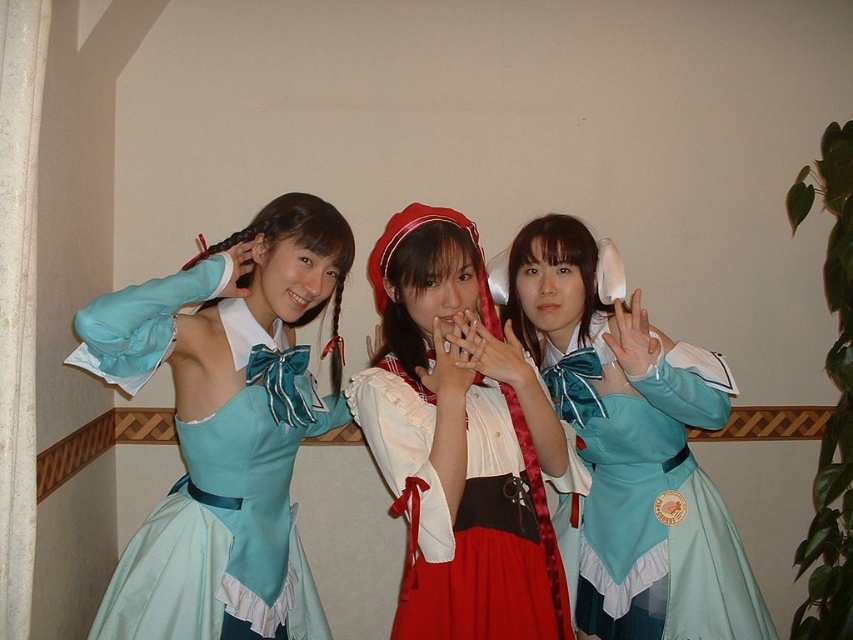
Between matte blue dress at left and matte blue dress at center, which one appears on the left side from the viewer's perspective?

matte blue dress at left is more to the left.

Who is shorter, matte blue dress at left or matte blue dress at center?

matte blue dress at left

At what (x,y) coordinates should I click in order to perform the action: click on matte blue dress at left. Please return your answer as a coordinate pair (x, y). Looking at the image, I should click on (225, 426).

Between point (181, 566) and point (421, 310), which one is positioned in front?

Point (421, 310) is more forward.

Measure the distance between matte blue dress at left and matte white blouse at center.

matte blue dress at left is 15.43 inches away from matte white blouse at center.

Between point (229, 308) and point (473, 449), which one is positioned behind?

The point (229, 308) is behind.

I want to click on matte blue dress at left, so click(225, 426).

Does matte white blouse at center appear on the right side of matte blue dress at center?

Incorrect, matte white blouse at center is not on the right side of matte blue dress at center.

Does matte white blouse at center lie in front of matte blue dress at center?

Yes, it is in front of matte blue dress at center.

This screenshot has width=853, height=640. What do you see at coordinates (460, 442) in the screenshot?
I see `matte white blouse at center` at bounding box center [460, 442].

Where is `matte white blouse at center`? This screenshot has height=640, width=853. matte white blouse at center is located at coordinates coord(460,442).